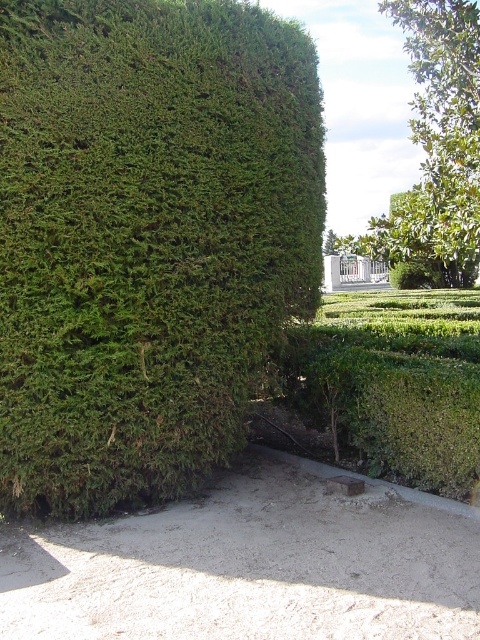
You are standing on the paved pathway in the garden and want to take a photo of both the green leafy hedge at left and the green leafy tree at upper right. Which object should you focus on first to ensure both are in sharp focus?

You should focus on the green leafy hedge at left first because it is closer to you than the green leafy tree at upper right. By focusing on the closer object, you can ensure both are in focus due to the depth of field extending from the hedge to the tree.

You are standing in the garden and want to take a photo of the green leafy hedge at left. If your camera has a minimum focusing distance of 10 feet, will you need to move closer or farther away to ensure the hedge is in focus?

The green leafy hedge at left is 13.52 feet from the viewer. Since the minimum focusing distance is 10 feet, you are already beyond the minimum requirement. Therefore, you do not need to move closer or farther away. The hedge is within the camera focusing range and should be in focus as long as you are at least 10 feet away.

You are planning to install a new garden bench. The bench requires a space wider than the green leafy hedge at left but narrower than the green leafy tree at upper right. Is there a suitable spot in the garden for the bench?

The green leafy hedge at left is narrower than the green leafy tree at upper right. Therefore, a bench requiring a space wider than the hedge but narrower than the tree can be placed between them or near the tree where there is enough width.